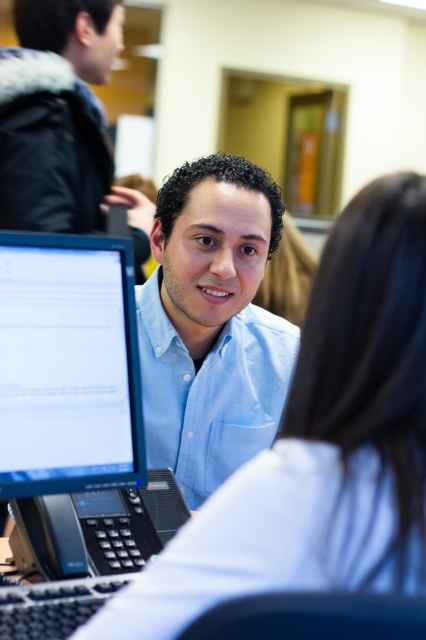
Question: Is matte black monitor at left above matte blue shirt at center?

Choices:
 (A) no
 (B) yes

Answer: (A)

Question: Which object appears farthest from the camera in this image?

Choices:
 (A) matte black monitor at left
 (B) white fabric shirt at center
 (C) matte blue shirt at center

Answer: (C)

Question: Which of the following is the closest to the observer?

Choices:
 (A) light blue shirt at center
 (B) white fabric shirt at center
 (C) matte blue shirt at center

Answer: (B)

Question: Does light blue shirt at center lie behind matte blue shirt at center?

Choices:
 (A) yes
 (B) no

Answer: (B)

Question: Among these objects, which one is farthest from the camera?

Choices:
 (A) matte black monitor at left
 (B) white fabric shirt at center
 (C) light blue shirt at center
 (D) matte blue shirt at center

Answer: (D)

Question: Observing the image, what is the correct spatial positioning of light blue shirt at center in reference to matte black monitor at left?

Choices:
 (A) above
 (B) below

Answer: (A)